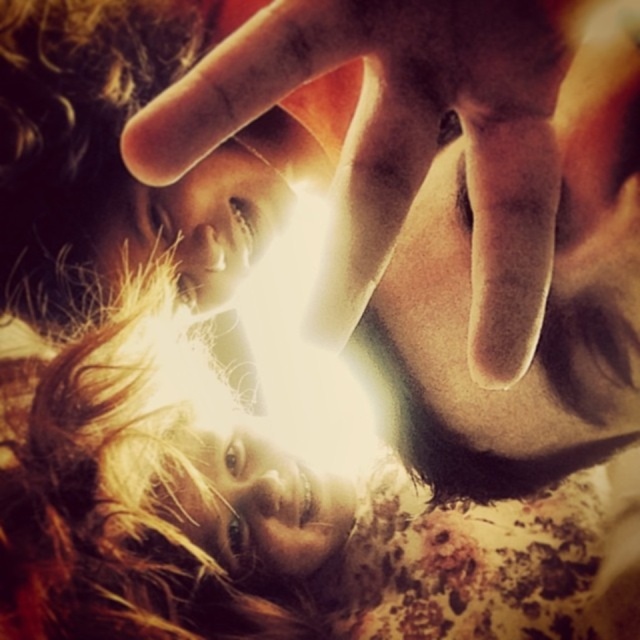
Question: Can you confirm if blonde hair at center is bigger than smooth skin hand at center?

Choices:
 (A) no
 (B) yes

Answer: (B)

Question: Which point appears farthest from the camera in this image?

Choices:
 (A) (538, 292)
 (B) (147, 602)

Answer: (B)

Question: Is blonde hair at center below smooth skin hand at center?

Choices:
 (A) yes
 (B) no

Answer: (A)

Question: Does blonde hair at center appear under smooth skin hand at center?

Choices:
 (A) no
 (B) yes

Answer: (B)

Question: Which point is farther to the camera?

Choices:
 (A) (483, 529)
 (B) (376, 211)

Answer: (A)